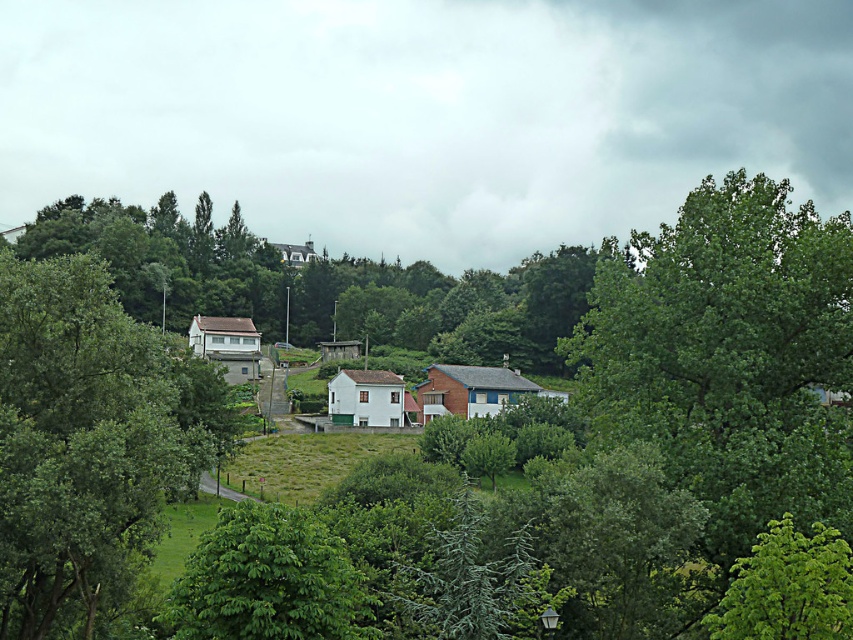
Can you confirm if green leafy tree at left is bigger than green leafy tree at lower right?

Yes, green leafy tree at left is bigger than green leafy tree at lower right.

Is point (114, 454) more distant than point (822, 600)?

Yes, point (114, 454) is behind point (822, 600).

This screenshot has width=853, height=640. Find the location of `green leafy tree at left`. green leafy tree at left is located at coordinates (88, 442).

Which is more to the left, green leafy tree at center or green leafy tree at lower right?

green leafy tree at center

I want to click on green leafy tree at center, so 318,284.

The width and height of the screenshot is (853, 640). I want to click on green leafy tree at center, so click(x=318, y=284).

From the picture: Is green leafy tree at right positioned behind green leafy tree at lower right?

That is True.

Describe the element at coordinates (729, 356) in the screenshot. This screenshot has width=853, height=640. I see `green leafy tree at right` at that location.

The width and height of the screenshot is (853, 640). Describe the element at coordinates (729, 356) in the screenshot. I see `green leafy tree at right` at that location.

Locate an element on the screen. green leafy tree at right is located at coordinates (729, 356).